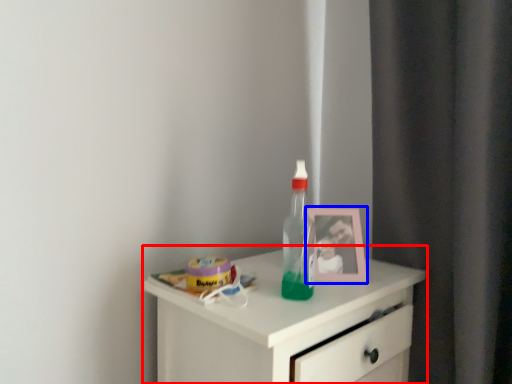
Question: Which of the following is the closest to the observer, chest of drawers (highlighted by a red box) or picture frame (highlighted by a blue box)?

Choices:
 (A) chest of drawers
 (B) picture frame

Answer: (A)